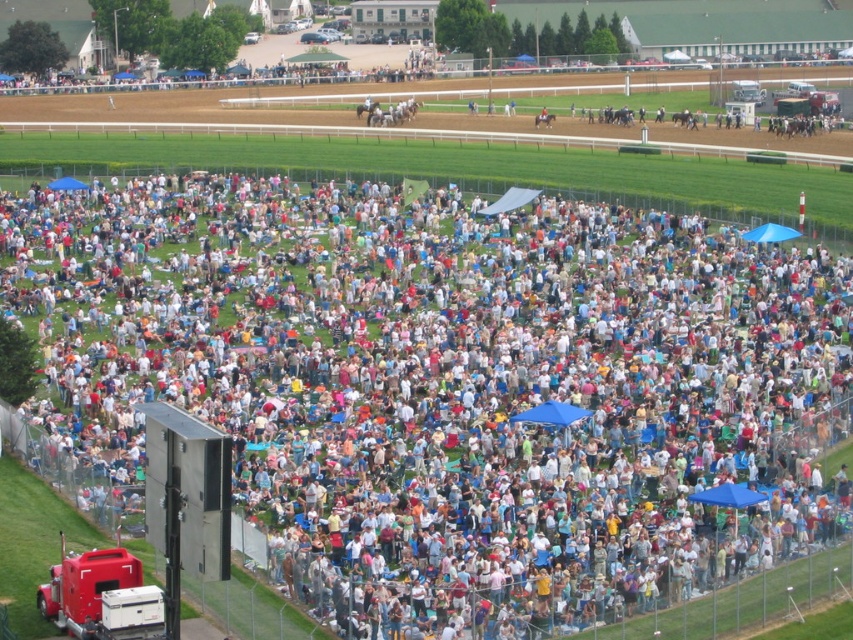
You are a photographer at the racetrack event. You want to take a photo of the white casual clothing at center and the red matte trailer truck at lower left. Which object should you focus on first to ensure both are in sharp focus?

The white casual clothing at center is closer to the viewer than the red matte trailer truck at lower left. To ensure both are in sharp focus, you should focus on the white casual clothing at center because it is closer, and the depth of field will extend to the truck behind it.

You are a photographer at the racetrack event and want to capture a photo that includes both the white casual clothing at center and the brown glossy horse at center. Based on their positions, which object should appear higher in the photo?

The brown glossy horse at center appears higher in the photo because the white casual clothing at center is located below it.